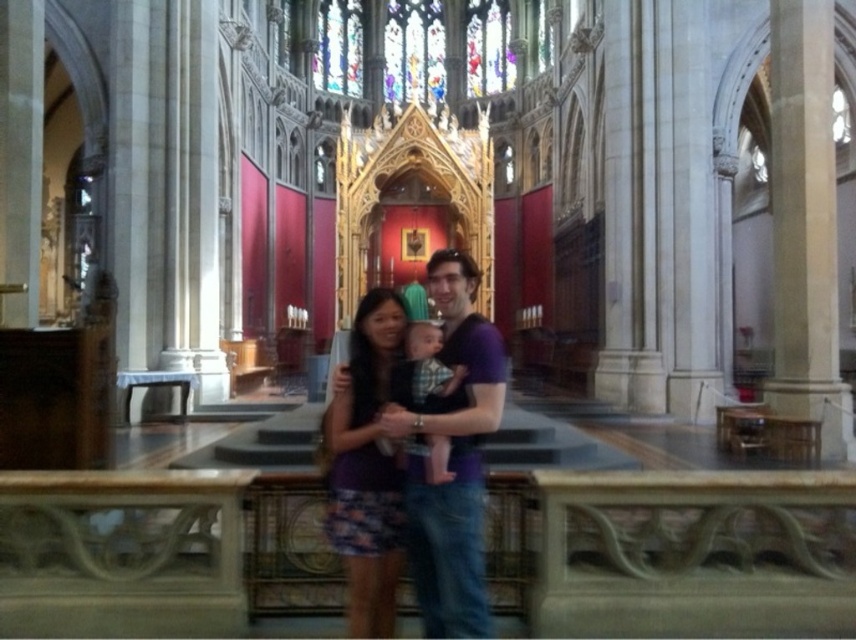
Question: Can you confirm if purple cotton shirt at center is smaller than purple fabric dress at center?

Choices:
 (A) yes
 (B) no

Answer: (B)

Question: Which object appears farthest from the camera in this image?

Choices:
 (A) purple cotton shirt at center
 (B) purple fabric dress at center

Answer: (B)

Question: Is purple cotton shirt at center wider than purple fabric dress at center?

Choices:
 (A) no
 (B) yes

Answer: (B)

Question: Does purple cotton shirt at center appear over purple fabric dress at center?

Choices:
 (A) yes
 (B) no

Answer: (A)

Question: Which of the following is the closest to the observer?

Choices:
 (A) (480, 524)
 (B) (383, 596)

Answer: (B)